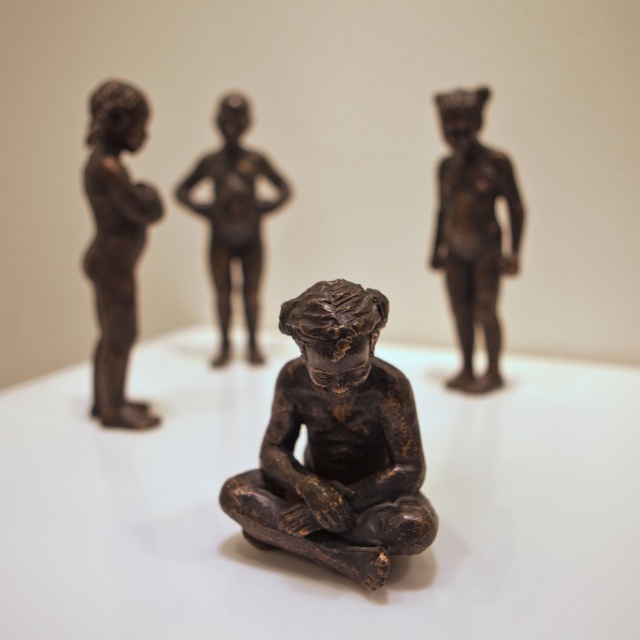
Does bronze statue at upper right appear under matte bronze figure at center?

Yes, bronze statue at upper right is below matte bronze figure at center.

Does bronze statue at upper right have a greater height compared to matte bronze figure at center?

Incorrect, bronze statue at upper right's height is not larger of matte bronze figure at center's.

Is point (477, 276) in front of point (234, 248)?

Yes, point (477, 276) is closer to viewer.

This screenshot has width=640, height=640. Find the location of `bronze statue at upper right`. bronze statue at upper right is located at coordinates (472, 230).

Is bronze statue at center shorter than matte bronze figure at center?

Yes.

Who is positioned more to the left, bronze statue at center or matte bronze figure at center?

matte bronze figure at center is more to the left.

The height and width of the screenshot is (640, 640). What are the coordinates of `bronze statue at center` in the screenshot? It's located at (337, 444).

Describe the element at coordinates (337, 444) in the screenshot. The width and height of the screenshot is (640, 640). I see `bronze statue at center` at that location.

Where is `bronze statue at center`? This screenshot has height=640, width=640. bronze statue at center is located at coordinates (337, 444).